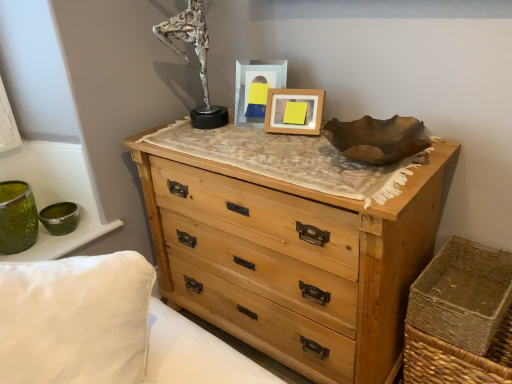
Where is `natural wood chest of drawers at center`? natural wood chest of drawers at center is located at coordinates (293, 259).

Which object is thinner, brown woven basket at lower right or silver metallic sculpture at upper center?

Thinner between the two is silver metallic sculpture at upper center.

Can you confirm if brown woven basket at lower right is shorter than silver metallic sculpture at upper center?

Indeed, brown woven basket at lower right has a lesser height compared to silver metallic sculpture at upper center.

Does point (477, 268) come closer to viewer compared to point (222, 122)?

Yes.

Can you tell me how much brown woven basket at lower right and silver metallic sculpture at upper center differ in facing direction?

There is a 0.0011-degree angle between the facing directions of brown woven basket at lower right and silver metallic sculpture at upper center.

From a real-world perspective, is silver metallic sculpture at upper center below matte plastic picture frame at center, which is counted as the 1th picture frame, starting from the left?

No, from a real-world perspective, silver metallic sculpture at upper center is not beneath matte plastic picture frame at center, which is counted as the 1th picture frame, starting from the left.

Is silver metallic sculpture at upper center positioned far away from matte plastic picture frame at center, the 2th picture frame from the right?

No, there isn't a large distance between silver metallic sculpture at upper center and matte plastic picture frame at center, the 2th picture frame from the right.

Is silver metallic sculpture at upper center turned away from matte plastic picture frame at center, the 2th picture frame from the right?

That's not correct — silver metallic sculpture at upper center is not looking away from matte plastic picture frame at center, the 2th picture frame from the right.

Does silver metallic sculpture at upper center have a lesser height compared to matte plastic picture frame at center, the 2th picture frame from the right?

In fact, silver metallic sculpture at upper center may be taller than matte plastic picture frame at center, the 2th picture frame from the right.

Who is smaller, wooden picture frame at center, marked as the 1th picture frame in a right-to-left arrangement, or brown woven basket at lower right?

wooden picture frame at center, marked as the 1th picture frame in a right-to-left arrangement, is smaller.

Measure the distance between wooden picture frame at center, marked as the 1th picture frame in a right-to-left arrangement, and brown woven basket at lower right.

They are 27.10 inches apart.

From a real-world perspective, is wooden picture frame at center, marked as the 1th picture frame in a right-to-left arrangement, physically located above or below brown woven basket at lower right?

wooden picture frame at center, marked as the 1th picture frame in a right-to-left arrangement, is situated higher than brown woven basket at lower right in the real world.

In the image, there is a wooden picture frame at center, marked as the 1th picture frame in a right-to-left arrangement. In order to click on crate below it (from a real-world perspective) in this screenshot , I will do `click(462, 295)`.

Is wooden picture frame at center, marked as the 1th picture frame in a right-to-left arrangement, not inside matte plastic picture frame at center, the 2th picture frame from the right?

Yes, wooden picture frame at center, marked as the 1th picture frame in a right-to-left arrangement, is not within matte plastic picture frame at center, the 2th picture frame from the right.

From the image's perspective, which one is positioned lower, wooden picture frame at center, marked as the 1th picture frame in a right-to-left arrangement, or matte plastic picture frame at center, the 2th picture frame from the right?

wooden picture frame at center, marked as the 1th picture frame in a right-to-left arrangement, is shown below in the image.

Based on the photo, from a real-world perspective, which object stands above the other?

In real-world perspective, matte plastic picture frame at center, the 2th picture frame from the right, is above.

Can wooden picture frame at center, marked as the 1th picture frame in a right-to-left arrangement, be found inside natural wood chest of drawers at center?

No.

From a real-world perspective, is natural wood chest of drawers at center positioned above or below wooden picture frame at center, which appears as the second picture frame when viewed from the left?

natural wood chest of drawers at center is situated lower than wooden picture frame at center, which appears as the second picture frame when viewed from the left, in the real world.

From the image's perspective, which is above, natural wood chest of drawers at center or wooden picture frame at center, which appears as the second picture frame when viewed from the left?

From the image's view, wooden picture frame at center, which appears as the second picture frame when viewed from the left, is above.

Considering the relative positions of brown woven basket at lower right and natural wood chest of drawers at center in the image provided, is brown woven basket at lower right to the left or to the right of natural wood chest of drawers at center?

From the image, it's evident that brown woven basket at lower right is to the right of natural wood chest of drawers at center.

Is brown woven basket at lower right in contact with natural wood chest of drawers at center?

No, brown woven basket at lower right is not beside natural wood chest of drawers at center.

In the scene shown: Considering the sizes of objects brown woven basket at lower right and natural wood chest of drawers at center in the image provided, who is shorter, brown woven basket at lower right or natural wood chest of drawers at center?

With less height is brown woven basket at lower right.

Does natural wood chest of drawers at center appear on the right side of silver metallic sculpture at upper center?

Indeed, natural wood chest of drawers at center is positioned on the right side of silver metallic sculpture at upper center.

Considering the positions of objects natural wood chest of drawers at center and silver metallic sculpture at upper center in the image provided, who is in front, natural wood chest of drawers at center or silver metallic sculpture at upper center?

natural wood chest of drawers at center is closer to the camera.

At what (x,y) coordinates should I click in order to perform the action: click on antique that is above the natural wood chest of drawers at center (from the image's perspective). Please return your answer as a coordinate pair (x, y). Image resolution: width=512 pixels, height=384 pixels. Looking at the image, I should click on (197, 56).

The image size is (512, 384). Find the location of `crate in front of the silver metallic sculpture at upper center`. crate in front of the silver metallic sculpture at upper center is located at coordinates (462, 295).

Identify the location of the 1st picture frame below the silver metallic sculpture at upper center (from the image's perspective). The height and width of the screenshot is (384, 512). (258, 82).

From the image, which object appears to be farther from silver metallic sculpture at upper center, matte plastic picture frame at center, which is counted as the 1th picture frame, starting from the left, or natural wood chest of drawers at center?

Among the two, natural wood chest of drawers at center is located further to silver metallic sculpture at upper center.

Considering their positions, is brown woven basket at lower right positioned closer to silver metallic sculpture at upper center than matte plastic picture frame at center, which is counted as the 1th picture frame, starting from the left?

The object closer to silver metallic sculpture at upper center is matte plastic picture frame at center, which is counted as the 1th picture frame, starting from the left.

Estimate the real-world distances between objects in this image. Which object is further from wooden picture frame at center, marked as the 1th picture frame in a right-to-left arrangement, brown woven basket at lower right or silver metallic sculpture at upper center?

brown woven basket at lower right.

When comparing their distances from natural wood chest of drawers at center, does silver metallic sculpture at upper center or brown woven basket at lower right seem closer?

Among the two, brown woven basket at lower right is located nearer to natural wood chest of drawers at center.

Looking at this image, considering their positions, is natural wood chest of drawers at center positioned further to brown woven basket at lower right than wooden picture frame at center, which appears as the second picture frame when viewed from the left?

wooden picture frame at center, which appears as the second picture frame when viewed from the left.

Which object lies nearer to the anchor point matte plastic picture frame at center, which is counted as the 1th picture frame, starting from the left, wooden picture frame at center, which appears as the second picture frame when viewed from the left, or brown woven basket at lower right?

wooden picture frame at center, which appears as the second picture frame when viewed from the left.

Estimate the real-world distances between objects in this image. Which object is further from matte plastic picture frame at center, which is counted as the 1th picture frame, starting from the left, silver metallic sculpture at upper center or brown woven basket at lower right?

brown woven basket at lower right.

Considering their positions, is brown woven basket at lower right positioned further to natural wood chest of drawers at center than matte plastic picture frame at center, which is counted as the 1th picture frame, starting from the left?

Among the two, matte plastic picture frame at center, which is counted as the 1th picture frame, starting from the left, is located further to natural wood chest of drawers at center.

Locate an element on the screen. The height and width of the screenshot is (384, 512). chest of drawers between wooden picture frame at center, which appears as the second picture frame when viewed from the left, and brown woven basket at lower right in the up-down direction is located at coordinates (293, 259).

Find the location of a particular element. picture frame between matte plastic picture frame at center, which is counted as the 1th picture frame, starting from the left, and brown woven basket at lower right, in the vertical direction is located at coordinates (286, 108).

Identify the location of the chest of drawers that lies between matte plastic picture frame at center, which is counted as the 1th picture frame, starting from the left, and brown woven basket at lower right from top to bottom. The width and height of the screenshot is (512, 384). (293, 259).

Find the location of `picture frame located between silver metallic sculpture at upper center and wooden picture frame at center, marked as the 1th picture frame in a right-to-left arrangement, in the left-right direction`. picture frame located between silver metallic sculpture at upper center and wooden picture frame at center, marked as the 1th picture frame in a right-to-left arrangement, in the left-right direction is located at coordinates (258, 82).